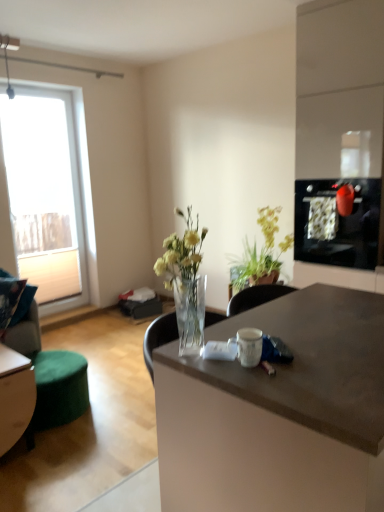
Image resolution: width=384 pixels, height=512 pixels. Find the location of `vacant space in front of white matte coffee cup at center`. vacant space in front of white matte coffee cup at center is located at coordinates (269, 377).